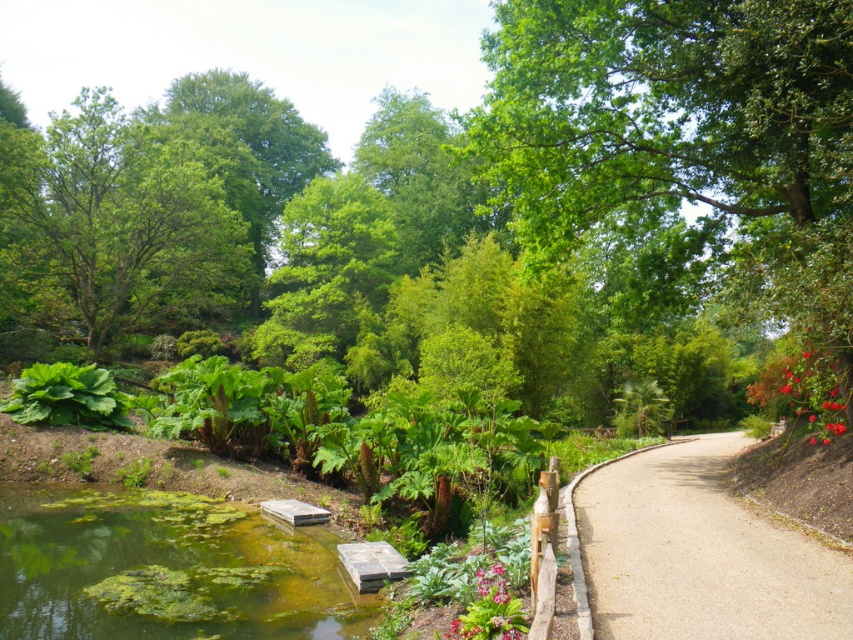
You are standing at the point marked as point (817, 579) in the garden. If you walk straight ahead, will you reach the wooden pathway before the pond?

The distance between the point (817, 579) and the wooden pathway is less than the distance to the pond, so yes, you will reach the wooden pathway before the pond.

You are planning to plant a new flower bed between the green leafy tree at upper center and the green leafy plant at lower center. Considering their sizes, which one might cast more shade over the flower bed?

The green leafy tree at upper center is much taller than the green leafy plant at lower center, so it will cast more shade over the flower bed.